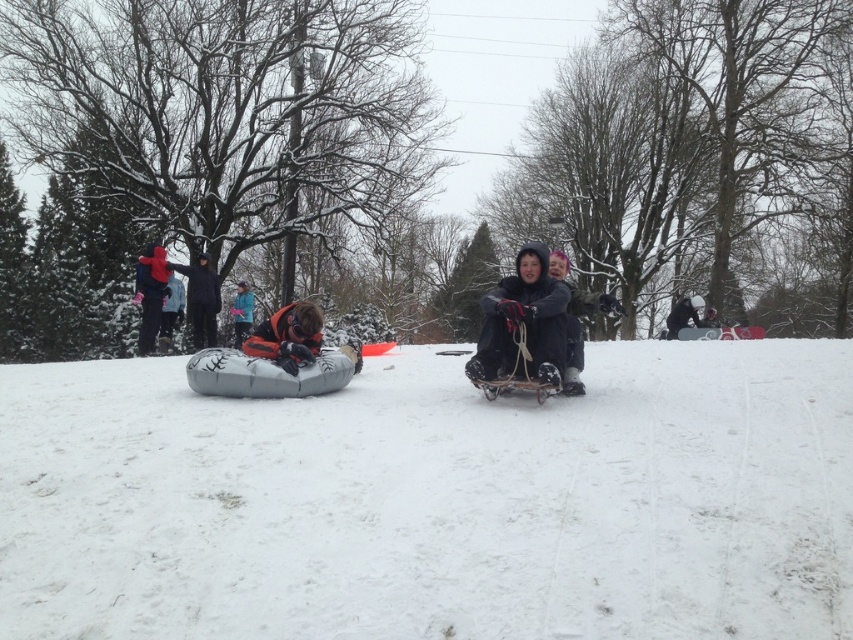
Is orange fleece jacket at center below dark blue jacket at upper left?

Indeed, orange fleece jacket at center is positioned under dark blue jacket at upper left.

Can you confirm if orange fleece jacket at center is thinner than dark blue jacket at upper left?

No, orange fleece jacket at center is not thinner than dark blue jacket at upper left.

Where is `orange fleece jacket at center`? orange fleece jacket at center is located at coordinates (287, 337).

This screenshot has width=853, height=640. Identify the location of orange fleece jacket at center. (287, 337).

Identify the location of white fluffy snow at center. Image resolution: width=853 pixels, height=640 pixels. (434, 500).

Between point (372, 362) and point (677, 324), which one is positioned behind?

The point (677, 324) is behind.

Who is more forward, [576,592] or [689,317]?

Point [576,592] is in front.

What are the coordinates of `white fluffy snow at center` in the screenshot? It's located at (434, 500).

Which of these two, blue fleece jacket at center or dark gray fabric jacket at center, stands shorter?

dark gray fabric jacket at center

Does blue fleece jacket at center have a smaller size compared to dark gray fabric jacket at center?

No.

The height and width of the screenshot is (640, 853). What do you see at coordinates (241, 312) in the screenshot? I see `blue fleece jacket at center` at bounding box center [241, 312].

Where is `blue fleece jacket at center`? blue fleece jacket at center is located at coordinates (241, 312).